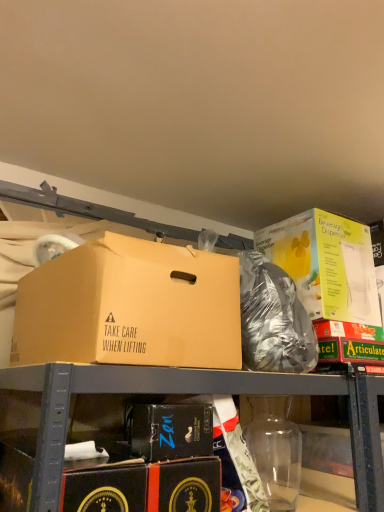
Question: Is black cardboard box at lower center, placed as the 2th box when sorted from right to left, facing away from matte cardboard box at upper left, placed as the 1th box when sorted from left to right?

Choices:
 (A) no
 (B) yes

Answer: (A)

Question: Considering the relative sizes of black cardboard box at lower center, which is counted as the 2th box, starting from the left, and matte cardboard box at upper left, which appears as the 3th box when viewed from the right, in the image provided, is black cardboard box at lower center, which is counted as the 2th box, starting from the left, taller than matte cardboard box at upper left, which appears as the 3th box when viewed from the right,?

Choices:
 (A) no
 (B) yes

Answer: (A)

Question: From a real-world perspective, is black cardboard box at lower center, which is counted as the 2th box, starting from the left, physically below matte cardboard box at upper left, placed as the 1th box when sorted from left to right?

Choices:
 (A) no
 (B) yes

Answer: (B)

Question: Is black cardboard box at lower center, which is counted as the 2th box, starting from the left, touching matte cardboard box at upper left, which appears as the 3th box when viewed from the right?

Choices:
 (A) yes
 (B) no

Answer: (B)

Question: Considering the relative sizes of black cardboard box at lower center, which is counted as the 2th box, starting from the left, and matte cardboard box at upper left, which appears as the 3th box when viewed from the right, in the image provided, is black cardboard box at lower center, which is counted as the 2th box, starting from the left, smaller than matte cardboard box at upper left, which appears as the 3th box when viewed from the right,?

Choices:
 (A) no
 (B) yes

Answer: (B)

Question: From the image's perspective, is black cardboard box at lower center, which is counted as the 2th box, starting from the left, below matte cardboard box at upper left, which appears as the 3th box when viewed from the right?

Choices:
 (A) no
 (B) yes

Answer: (B)

Question: Is yellow cardboard beverage dispenser at upper right, the 3th box from the left, at the left side of transparent plastic bottle at lower center?

Choices:
 (A) no
 (B) yes

Answer: (A)

Question: Is yellow cardboard beverage dispenser at upper right, the 3th box from the left, not near transparent plastic bottle at lower center?

Choices:
 (A) yes
 (B) no

Answer: (B)

Question: Is transparent plastic bottle at lower center at the back of yellow cardboard beverage dispenser at upper right, the 3th box from the left?

Choices:
 (A) no
 (B) yes

Answer: (A)

Question: Considering the relative sizes of yellow cardboard beverage dispenser at upper right, the 3th box from the left, and transparent plastic bottle at lower center in the image provided, is yellow cardboard beverage dispenser at upper right, the 3th box from the left, bigger than transparent plastic bottle at lower center?

Choices:
 (A) yes
 (B) no

Answer: (A)

Question: Considering the relative sizes of yellow cardboard beverage dispenser at upper right, the 3th box from the left, and transparent plastic bottle at lower center in the image provided, is yellow cardboard beverage dispenser at upper right, the 3th box from the left, smaller than transparent plastic bottle at lower center?

Choices:
 (A) yes
 (B) no

Answer: (B)

Question: From a real-world perspective, is yellow cardboard beverage dispenser at upper right, which is the 1th box from right to left, on transparent plastic bottle at lower center?

Choices:
 (A) no
 (B) yes

Answer: (B)

Question: Could you tell me if black cardboard box at lower center, which is counted as the 2th box, starting from the left, is turned towards transparent plastic bottle at lower center?

Choices:
 (A) no
 (B) yes

Answer: (A)